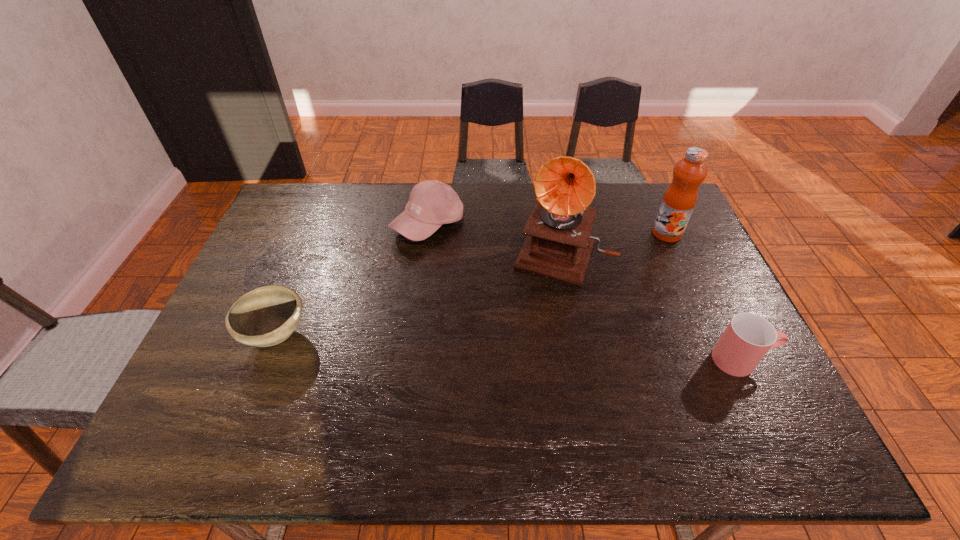
This screenshot has width=960, height=540. I want to click on free space on the desktop that is between the leftmost object and the cup and is positioned on the front-facing side of the baseball cap, so [469, 346].

Locate an element on the screen. vacant space on the desktop that is between the shortest object and the cup and is positioned on the front label of the second tallest object is located at coordinates (540, 349).

This screenshot has height=540, width=960. I want to click on vacant space on the desktop that is between the bowl and the cup and is positioned on the horn of the tallest object, so click(x=529, y=349).